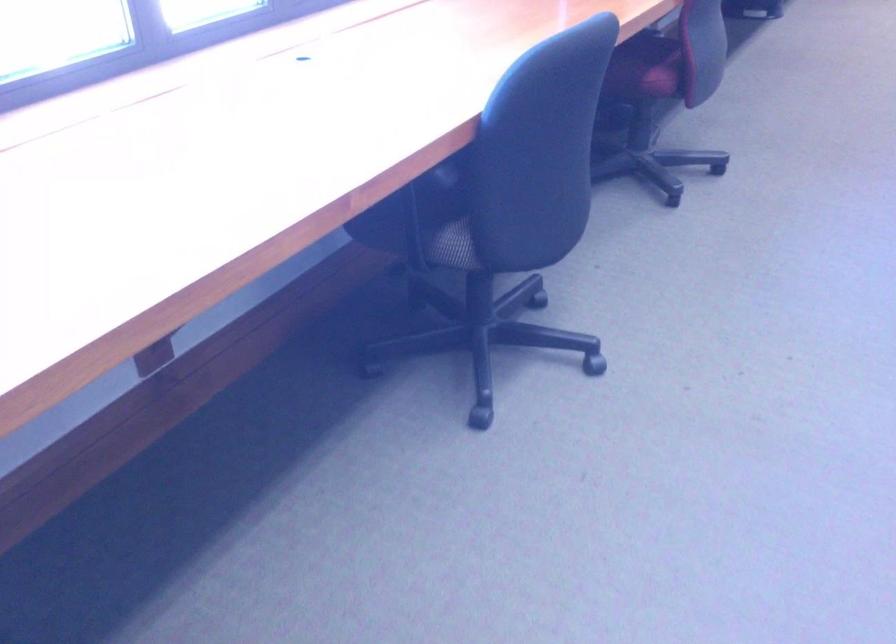
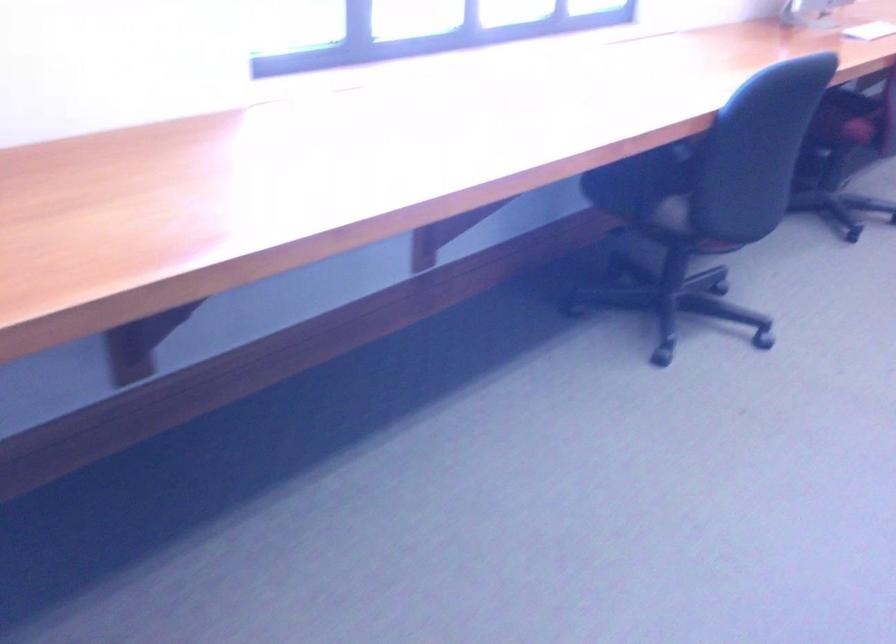
Question: What movement of the cameraman would produce the second image?

Choices:
 (A) Left
 (B) Right
 (C) Forward
 (D) Backward

Answer: (D)